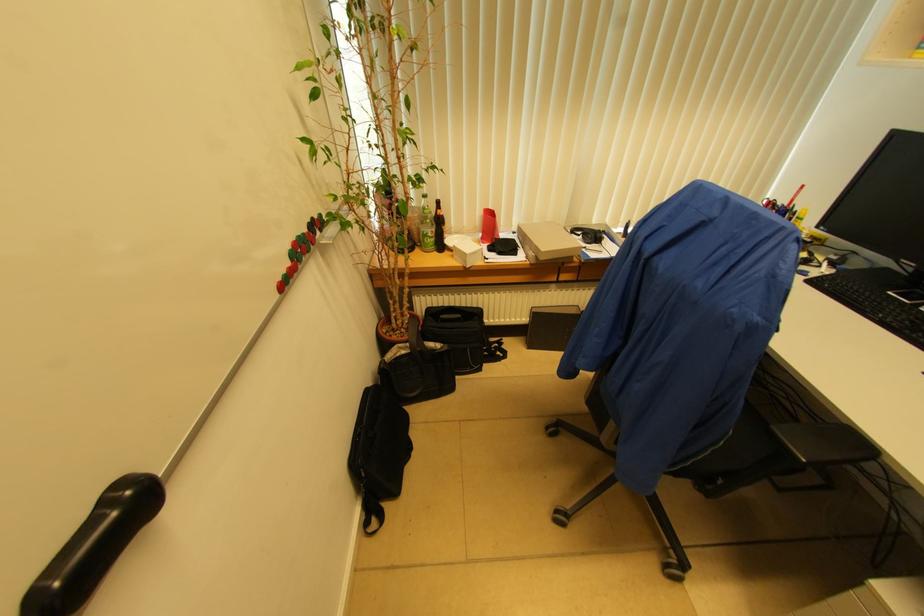
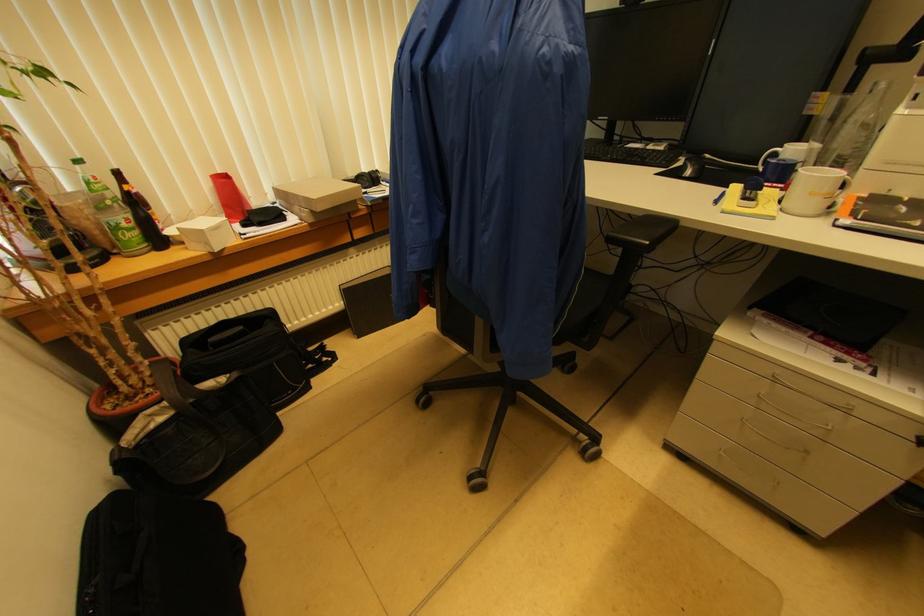
Locate, in the second image, the point that corresponds to [440,205] in the first image.

(118, 176)